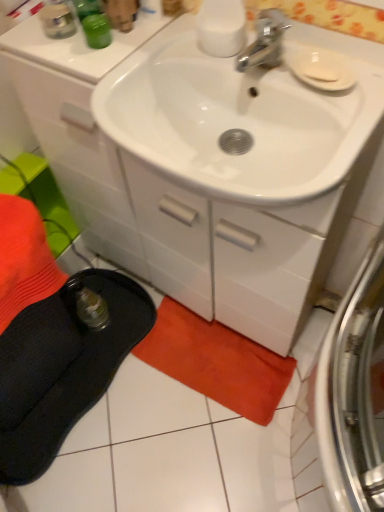
Where is `space that is in front of white matte soap at upper right`? space that is in front of white matte soap at upper right is located at coordinates (343, 111).